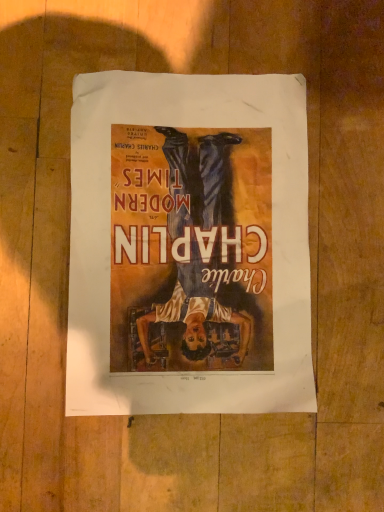
Locate an element on the screen. Image resolution: width=384 pixels, height=512 pixels. free point above matte paper poster at center (from a real-world perspective) is located at coordinates (199, 268).